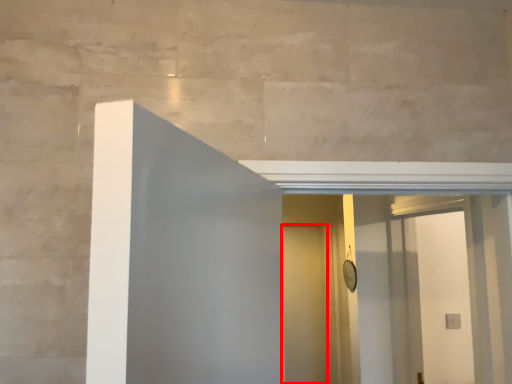
Question: In this image, where is door (annotated by the red box) located relative to screen door?

Choices:
 (A) left
 (B) right

Answer: (A)